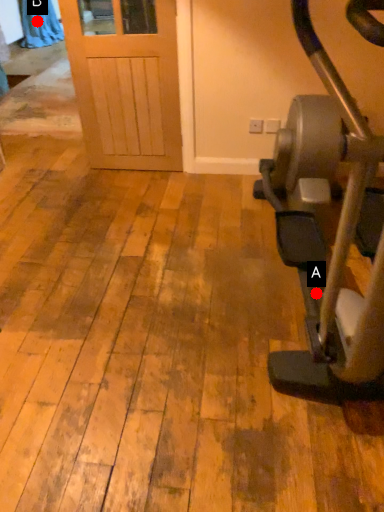
Question: Two points are circled on the image, labeled by A and B beside each circle. Which of the following is the closest to the observer?

Choices:
 (A) A is closer
 (B) B is closer

Answer: (A)